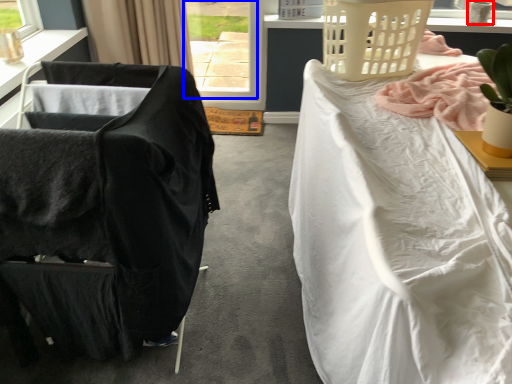
Question: Which object is closer to the camera taking this photo, lamp (highlighted by a red box) or window (highlighted by a blue box)?

Choices:
 (A) lamp
 (B) window

Answer: (A)